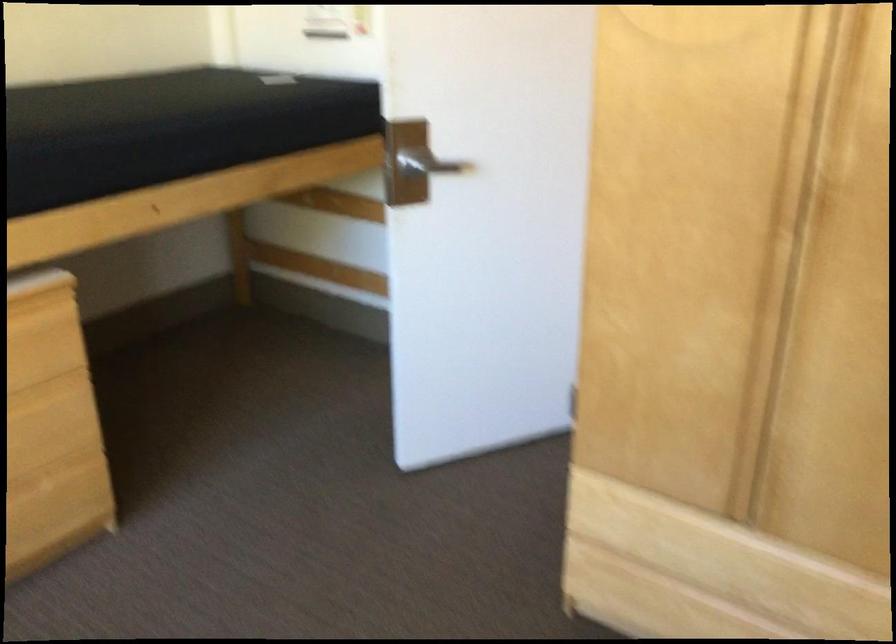
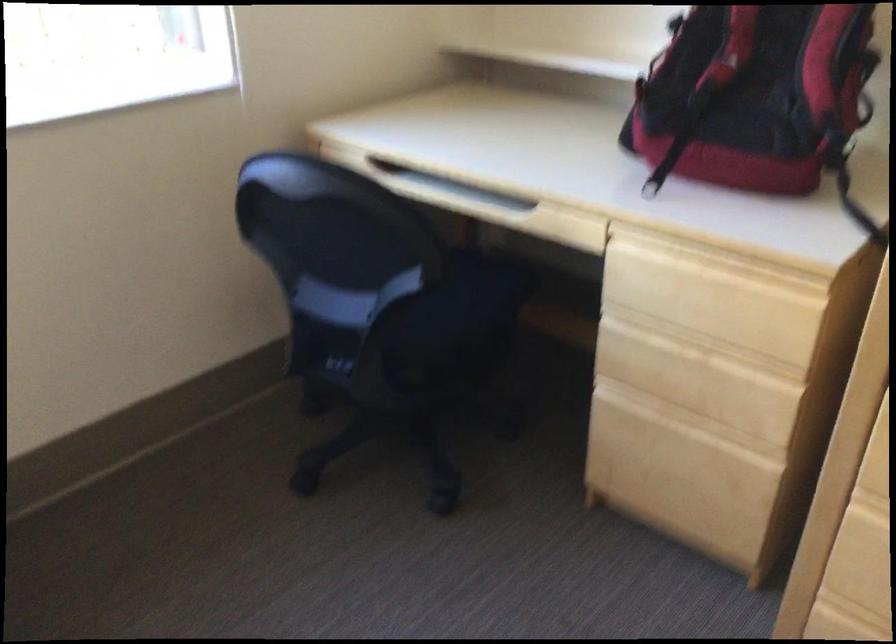
The first image is from the beginning of the video and the second image is from the end. How did the camera likely rotate when shooting the video?

The rotation direction of the camera is left-down.